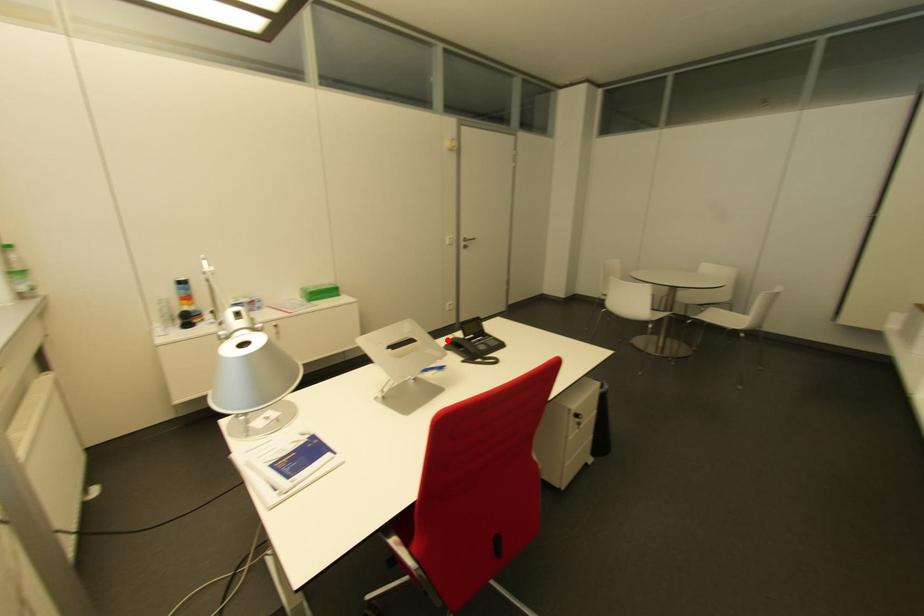
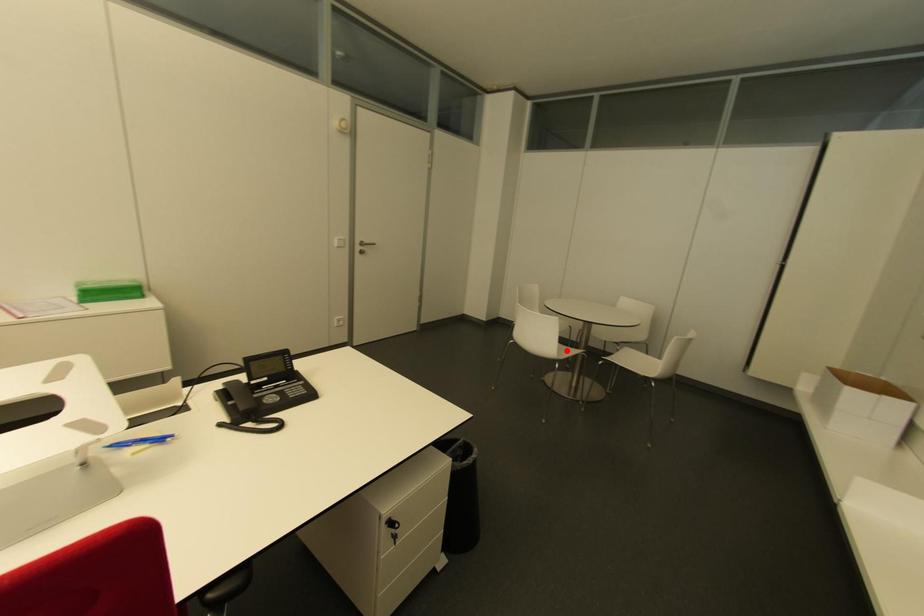
I am providing you with two images of the same scene from different viewpoints. A red point is marked on the first image and another point is marked on the second image. Is the red point in image1 aligned with the point shown in image2?

No